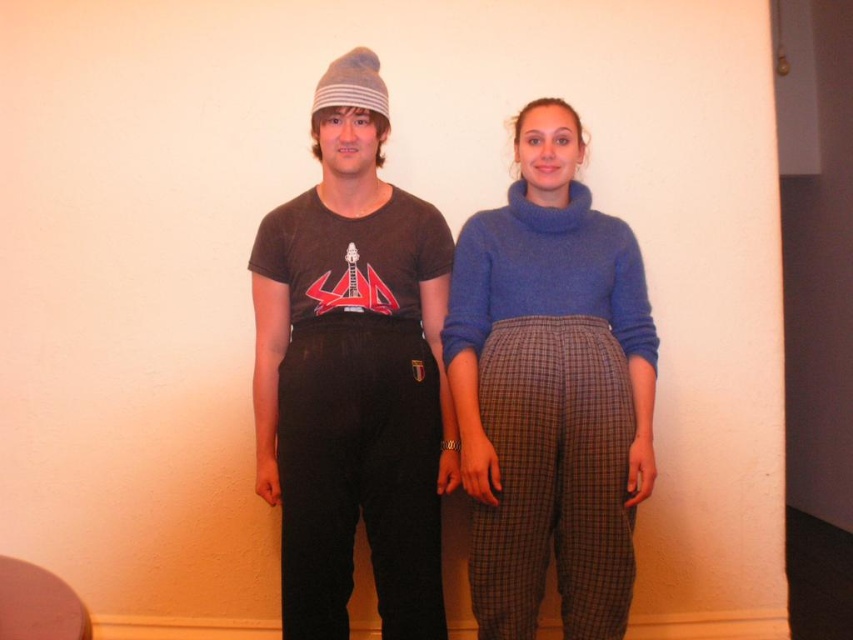
Is point (367, 212) positioned after point (515, 122)?

That is False.

Which is more to the right, matte black pants at center or blue woolen sweater at center?

blue woolen sweater at center

Which is behind, point (339, 410) or point (453, 403)?

Positioned behind is point (453, 403).

You are a GUI agent. You are given a task and a screenshot of the screen. Output one action in this format:
    pyautogui.click(x=<x>, y=<y>)
    Task: Click on the matte black pants at center
    The width and height of the screenshot is (853, 640).
    Given the screenshot: What is the action you would take?
    pyautogui.click(x=352, y=387)

Can you confirm if blue woolen sweater at center is taller than striped knit beanie at center?

Correct, blue woolen sweater at center is much taller as striped knit beanie at center.

Can you confirm if blue woolen sweater at center is positioned above striped knit beanie at center?

No, blue woolen sweater at center is not above striped knit beanie at center.

Does point (564, 145) lie behind point (367, 61)?

Yes, point (564, 145) is farther from viewer.

Where is `blue woolen sweater at center`? blue woolen sweater at center is located at coordinates (550, 390).

Image resolution: width=853 pixels, height=640 pixels. Identify the location of matte black pants at center. (352, 387).

Is point (402, 208) behind point (596, 332)?

Yes, it is behind point (596, 332).

Where is `matte black pants at center`? The height and width of the screenshot is (640, 853). matte black pants at center is located at coordinates (352, 387).